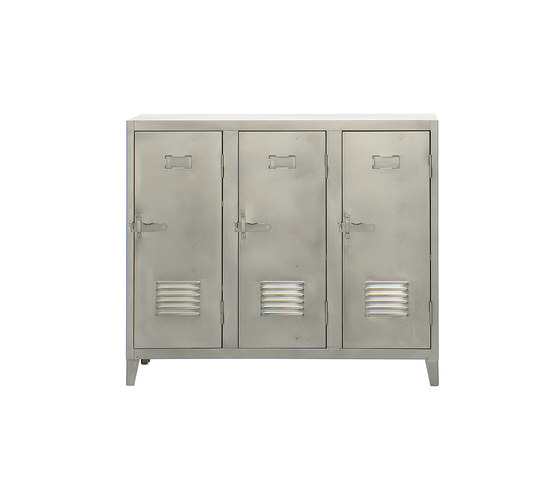
You are a GUI agent. You are given a task and a screenshot of the screen. Output one action in this format:
    pyautogui.click(x=<x>, y=<y>)
    Task: Click on the middle door
    
    Given the screenshot: What is the action you would take?
    pyautogui.click(x=272, y=266)